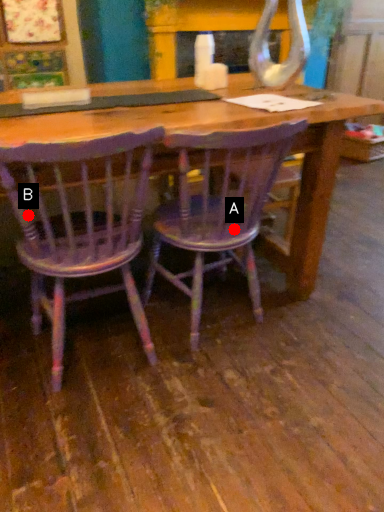
Question: Two points are circled on the image, labeled by A and B beside each circle. Which point is farther from the camera taking this photo?

Choices:
 (A) A is further
 (B) B is further

Answer: (A)